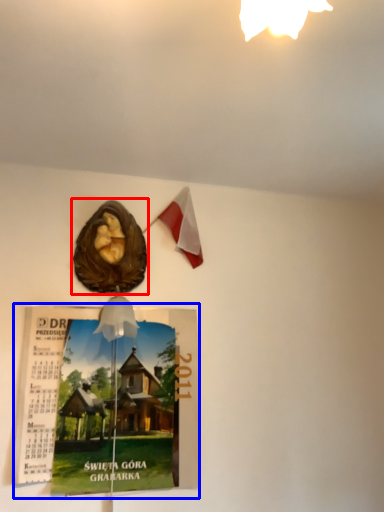
Question: Which point is closer to the camera, flyer (highlighted by a red box) or magazine (highlighted by a blue box)?

Choices:
 (A) flyer
 (B) magazine

Answer: (B)